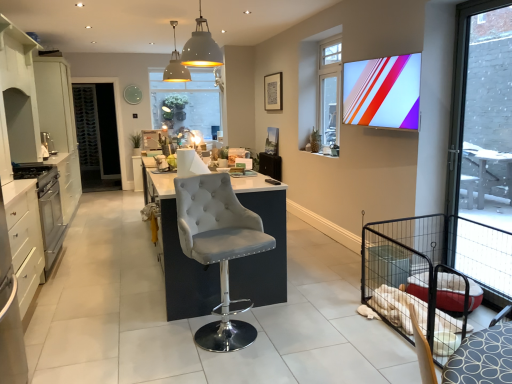
I want to click on free space on the front side of velvet grey bar stool at center, so click(240, 364).